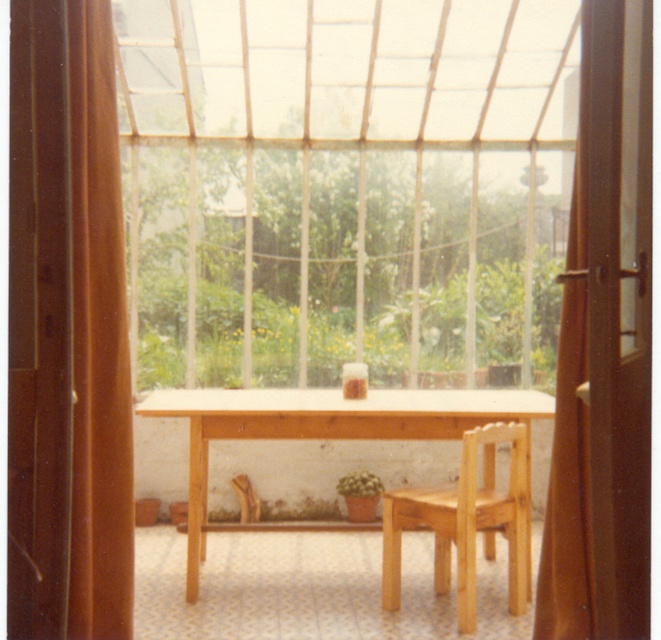
At what (x,y) coordinates should I click in order to perform the action: click on green leafy plant at center. Please return your answer as a coordinate pair (x, y). This screenshot has width=661, height=640. Looking at the image, I should click on (498, 323).

Who is more forward, (139, 348) or (196, 584)?

Point (196, 584) is more forward.

Find the location of a particular element. This screenshot has width=661, height=640. green leafy plant at center is located at coordinates (498, 323).

Which is below, natural wood chair at center or green matte plant at center?

green matte plant at center is lower down.

Is natural wood chair at center closer to camera compared to green matte plant at center?

Yes, natural wood chair at center is closer to the viewer.

You are a GUI agent. You are given a task and a screenshot of the screen. Output one action in this format:
    pyautogui.click(x=<x>, y=<y>)
    Task: Click on the natural wood chair at center
    Image resolution: width=661 pixels, height=640 pixels.
    Given the screenshot: What is the action you would take?
    pyautogui.click(x=465, y=522)

Does brown fabric curtain at left appear over green matte plant at center?

Yes.

Can you confirm if brown fabric curtain at left is positioned to the left of green matte plant at center?

Yes, brown fabric curtain at left is to the left of green matte plant at center.

At what (x,y) coordinates should I click in order to perform the action: click on brown fabric curtain at left. Please return your answer as a coordinate pair (x, y). The image size is (661, 640). Looking at the image, I should click on (98, 340).

Locate an element on the screen. The image size is (661, 640). brown fabric curtain at left is located at coordinates (98, 340).